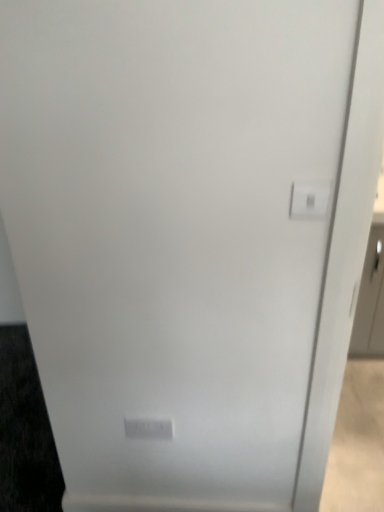
Where is `white plastic light switch at upper right, placed as the 2th light switch when sorted from bottom to top`? white plastic light switch at upper right, placed as the 2th light switch when sorted from bottom to top is located at coordinates (309, 200).

Describe the element at coordinates (309, 200) in the screenshot. I see `white plastic light switch at upper right, the first light switch viewed from the front` at that location.

Measure the distance between white plastic light switch at lower center, the first light switch when ordered from bottom to top, and camera.

The distance of white plastic light switch at lower center, the first light switch when ordered from bottom to top, from camera is 1.35 meters.

Describe the element at coordinates (148, 429) in the screenshot. This screenshot has width=384, height=512. I see `white plastic light switch at lower center, arranged as the second light switch when viewed from the right` at that location.

What are the coordinates of `white plastic light switch at lower center, the 2th light switch positioned from the front` in the screenshot? It's located at pos(148,429).

Where is `white plastic light switch at upper right, the 1th light switch viewed from the top`? white plastic light switch at upper right, the 1th light switch viewed from the top is located at coordinates (309, 200).

Between white plastic light switch at upper right, the 1th light switch viewed from the top, and white plastic light switch at lower center, arranged as the 1th light switch when viewed from the left, which one appears on the right side from the viewer's perspective?

Positioned to the right is white plastic light switch at upper right, the 1th light switch viewed from the top.

Which object is closer to the camera, white plastic light switch at upper right, the first light switch viewed from the front, or white plastic light switch at lower center, arranged as the second light switch when viewed from the top?

white plastic light switch at upper right, the first light switch viewed from the front, is closer to the camera.

Is point (317, 212) behind point (140, 435)?

That is False.

Looking at this image, from the image's perspective, is white plastic light switch at upper right, the 1th light switch viewed from the top, over white plastic light switch at lower center, arranged as the second light switch when viewed from the top?

Yes, from the image's perspective, white plastic light switch at upper right, the 1th light switch viewed from the top, is above white plastic light switch at lower center, arranged as the second light switch when viewed from the top.

From a real-world perspective, is white plastic light switch at upper right, marked as the 1th light switch in a right-to-left arrangement, physically located above or below white plastic light switch at lower center, arranged as the second light switch when viewed from the right?

white plastic light switch at upper right, marked as the 1th light switch in a right-to-left arrangement, is situated higher than white plastic light switch at lower center, arranged as the second light switch when viewed from the right, in the real world.

Which of these two, white plastic light switch at upper right, the second light switch in the back-to-front sequence, or white plastic light switch at lower center, the first light switch in the back-to-front sequence, is thinner?

Thinner between the two is white plastic light switch at lower center, the first light switch in the back-to-front sequence.

In the scene shown: Considering the relative sizes of white plastic light switch at upper right, placed as the 2th light switch when sorted from bottom to top, and white plastic light switch at lower center, the first light switch in the back-to-front sequence, in the image provided, is white plastic light switch at upper right, placed as the 2th light switch when sorted from bottom to top, shorter than white plastic light switch at lower center, the first light switch in the back-to-front sequence,?

Yes.

Can you confirm if white plastic light switch at upper right, the first light switch viewed from the front, is bigger than white plastic light switch at lower center, arranged as the 1th light switch when viewed from the left?

Incorrect, white plastic light switch at upper right, the first light switch viewed from the front, is not larger than white plastic light switch at lower center, arranged as the 1th light switch when viewed from the left.

Do you think white plastic light switch at upper right, marked as the 1th light switch in a right-to-left arrangement, is within white plastic light switch at lower center, the first light switch in the back-to-front sequence, or outside of it?

white plastic light switch at upper right, marked as the 1th light switch in a right-to-left arrangement, lies outside white plastic light switch at lower center, the first light switch in the back-to-front sequence.

Can you see white plastic light switch at upper right, the first light switch viewed from the front, touching white plastic light switch at lower center, the 2th light switch positioned from the front?

No, white plastic light switch at upper right, the first light switch viewed from the front, is not beside white plastic light switch at lower center, the 2th light switch positioned from the front.

Could you tell me if white plastic light switch at upper right, the first light switch viewed from the front, is facing white plastic light switch at lower center, the 2th light switch positioned from the front?

No, white plastic light switch at upper right, the first light switch viewed from the front, is not facing towards white plastic light switch at lower center, the 2th light switch positioned from the front.

How many degrees apart are the facing directions of white plastic light switch at upper right, placed as the 2th light switch when sorted from bottom to top, and white plastic light switch at lower center, arranged as the second light switch when viewed from the top?

They differ by 0.583 degrees in their facing directions.

The image size is (384, 512). In order to click on light switch on the left of white plastic light switch at upper right, the first light switch viewed from the front in this screenshot , I will do `click(148, 429)`.

Considering the relative positions of white plastic light switch at lower center, arranged as the 1th light switch when viewed from the left, and white plastic light switch at upper right, the 1th light switch viewed from the top, in the image provided, is white plastic light switch at lower center, arranged as the 1th light switch when viewed from the left, to the left or to the right of white plastic light switch at upper right, the 1th light switch viewed from the top,?

In the image, white plastic light switch at lower center, arranged as the 1th light switch when viewed from the left, appears on the left side of white plastic light switch at upper right, the 1th light switch viewed from the top.

Is white plastic light switch at lower center, the first light switch when ordered from bottom to top, behind white plastic light switch at upper right, placed as the 2th light switch when sorted from bottom to top?

Yes.

Is point (147, 428) positioned in front of point (303, 185)?

No, (147, 428) is behind (303, 185).

From the image's perspective, which one is positioned higher, white plastic light switch at lower center, arranged as the second light switch when viewed from the top, or white plastic light switch at upper right, the second light switch in the back-to-front sequence?

white plastic light switch at upper right, the second light switch in the back-to-front sequence, is shown above in the image.

From a real-world perspective, between white plastic light switch at lower center, arranged as the second light switch when viewed from the top, and white plastic light switch at upper right, marked as the 1th light switch in a right-to-left arrangement, who is vertically higher?

In real-world perspective, white plastic light switch at upper right, marked as the 1th light switch in a right-to-left arrangement, is above.

Between white plastic light switch at lower center, the first light switch in the back-to-front sequence, and white plastic light switch at upper right, the first light switch viewed from the front, which one has larger width?

Wider between the two is white plastic light switch at upper right, the first light switch viewed from the front.

Is white plastic light switch at lower center, the first light switch in the back-to-front sequence, shorter than white plastic light switch at upper right, the second light switch in the back-to-front sequence?

No, white plastic light switch at lower center, the first light switch in the back-to-front sequence, is not shorter than white plastic light switch at upper right, the second light switch in the back-to-front sequence.

Is white plastic light switch at lower center, arranged as the second light switch when viewed from the right, bigger than white plastic light switch at upper right, placed as the 2th light switch when sorted from bottom to top?

Indeed, white plastic light switch at lower center, arranged as the second light switch when viewed from the right, has a larger size compared to white plastic light switch at upper right, placed as the 2th light switch when sorted from bottom to top.

Consider the image. Is white plastic light switch at upper right, the second light switch in the back-to-front sequence, completely or partially inside white plastic light switch at lower center, the first light switch in the back-to-front sequence?

No.

Are white plastic light switch at lower center, the first light switch when ordered from bottom to top, and white plastic light switch at upper right, the first light switch viewed from the front, beside each other?

There is a gap between white plastic light switch at lower center, the first light switch when ordered from bottom to top, and white plastic light switch at upper right, the first light switch viewed from the front.

Is white plastic light switch at lower center, arranged as the 1th light switch when viewed from the left, oriented away from white plastic light switch at upper right, the second light switch in the back-to-front sequence?

That's not correct — white plastic light switch at lower center, arranged as the 1th light switch when viewed from the left, is not looking away from white plastic light switch at upper right, the second light switch in the back-to-front sequence.

How many degrees apart are the facing directions of white plastic light switch at lower center, arranged as the second light switch when viewed from the top, and white plastic light switch at upper right, the 2th light switch when ordered from left to right?

The angle between the facing direction of white plastic light switch at lower center, arranged as the second light switch when viewed from the top, and the facing direction of white plastic light switch at upper right, the 2th light switch when ordered from left to right, is 0.583 degrees.

Measure the distance from white plastic light switch at lower center, arranged as the 1th light switch when viewed from the left, to white plastic light switch at upper right, the first light switch viewed from the front.

They are 83.15 centimeters apart.

Where is `light switch behind the white plastic light switch at upper right, marked as the 1th light switch in a right-to-left arrangement`? The height and width of the screenshot is (512, 384). light switch behind the white plastic light switch at upper right, marked as the 1th light switch in a right-to-left arrangement is located at coordinates (148, 429).

Locate an element on the screen. This screenshot has height=512, width=384. light switch above the white plastic light switch at lower center, arranged as the 1th light switch when viewed from the left (from the image's perspective) is located at coordinates (309, 200).

What are the coordinates of `light switch located on the left of white plastic light switch at upper right, the 2th light switch when ordered from left to right` in the screenshot? It's located at (148, 429).